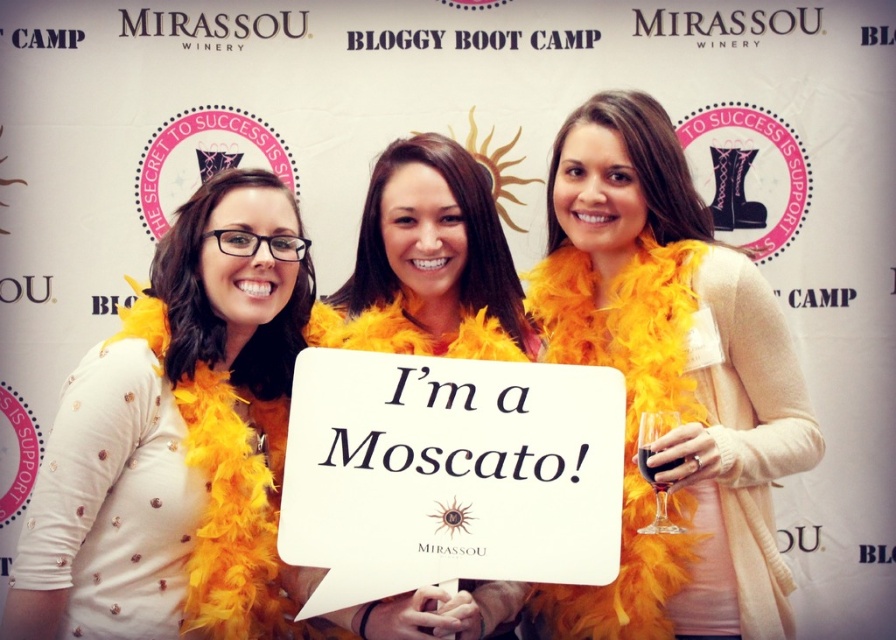
Is the position of matte orange feather boa at center more distant than that of feather boa at center?

No.

Does matte orange feather boa at center have a lesser width compared to feather boa at center?

No, matte orange feather boa at center is not thinner than feather boa at center.

This screenshot has height=640, width=896. Identify the location of matte orange feather boa at center. (670, 381).

Looking at this image, does matte orange feather boa at center have a lesser width compared to white sequined top at center?

Incorrect, matte orange feather boa at center's width is not less than white sequined top at center's.

Which is behind, point (659, 120) or point (191, 497)?

The point (659, 120) is more distant.

Find the location of `matte orange feather boa at center`. matte orange feather boa at center is located at coordinates (670, 381).

Does point (125, 364) come behind point (382, 324)?

No, it is in front of (382, 324).

Image resolution: width=896 pixels, height=640 pixels. Find the location of `white sequined top at center`. white sequined top at center is located at coordinates pos(175,433).

Locate an element on the screen. white sequined top at center is located at coordinates (175, 433).